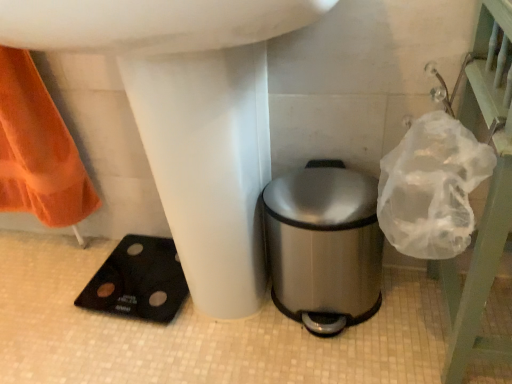
Question: Is stainless steel trash can at lower right wider than clear plastic bag at upper right?

Choices:
 (A) no
 (B) yes

Answer: (B)

Question: Is stainless steel trash can at lower right at the right side of clear plastic bag at upper right?

Choices:
 (A) no
 (B) yes

Answer: (A)

Question: Is stainless steel trash can at lower right further to camera compared to clear plastic bag at upper right?

Choices:
 (A) no
 (B) yes

Answer: (B)

Question: Is stainless steel trash can at lower right positioned beyond the bounds of clear plastic bag at upper right?

Choices:
 (A) no
 (B) yes

Answer: (B)

Question: Is stainless steel trash can at lower right to the left of clear plastic bag at upper right from the viewer's perspective?

Choices:
 (A) no
 (B) yes

Answer: (B)

Question: Considering the positions of stainless steel trash can at lower right and clear plastic bag at upper right in the image, is stainless steel trash can at lower right wider or thinner than clear plastic bag at upper right?

Choices:
 (A) wide
 (B) thin

Answer: (A)

Question: Considering the positions of stainless steel trash can at lower right and clear plastic bag at upper right in the image, is stainless steel trash can at lower right bigger or smaller than clear plastic bag at upper right?

Choices:
 (A) big
 (B) small

Answer: (B)

Question: In terms of height, does stainless steel trash can at lower right look taller or shorter compared to clear plastic bag at upper right?

Choices:
 (A) tall
 (B) short

Answer: (B)

Question: Considering their positions, is stainless steel trash can at lower right located in front of or behind clear plastic bag at upper right?

Choices:
 (A) behind
 (B) front

Answer: (A)

Question: In the image, is clear plastic bag at upper right positioned in front of or behind stainless steel trash can at lower right?

Choices:
 (A) front
 (B) behind

Answer: (A)

Question: Is clear plastic bag at upper right to the left or to the right of stainless steel trash can at lower right in the image?

Choices:
 (A) left
 (B) right

Answer: (B)

Question: Is clear plastic bag at upper right inside or outside of stainless steel trash can at lower right?

Choices:
 (A) outside
 (B) inside

Answer: (A)

Question: Considering the positions of clear plastic bag at upper right and stainless steel trash can at lower right in the image, is clear plastic bag at upper right wider or thinner than stainless steel trash can at lower right?

Choices:
 (A) thin
 (B) wide

Answer: (A)

Question: From the image's perspective, is clear plastic bag at upper right above or below white glossy sink at center?

Choices:
 (A) above
 (B) below

Answer: (B)

Question: Is clear plastic bag at upper right inside the boundaries of white glossy sink at center, or outside?

Choices:
 (A) outside
 (B) inside

Answer: (A)